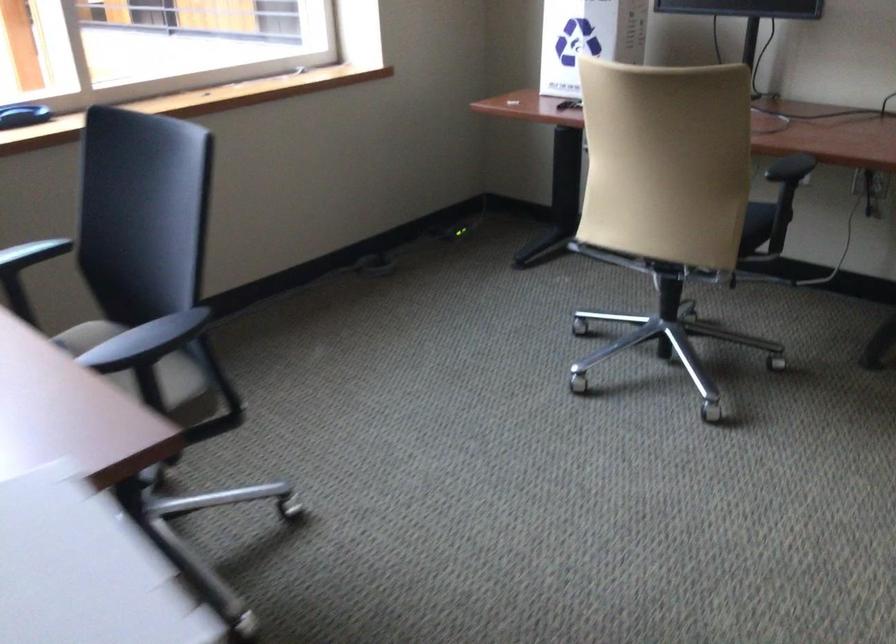
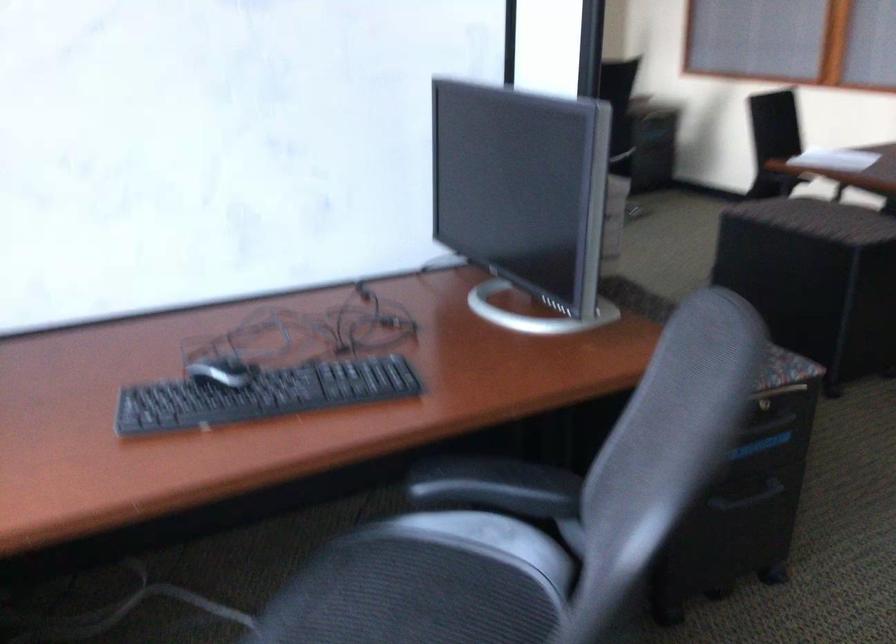
Question: I am providing you with two images of the same scene from different viewpoints. After the viewpoint changes to image2, which objects are now occluded?

Choices:
 (A) chair sitting surface
 (B) beige chair armrest
 (C) computer mouse
 (D) colorful stacking ring

Answer: (B)